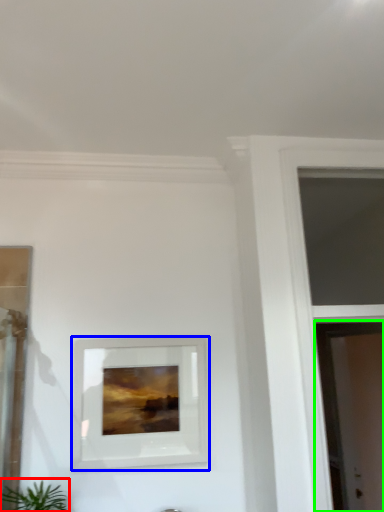
Question: Which object is positioned closest to houseplant (highlighted by a red box)? Select from picture frame (highlighted by a blue box) and screen door (highlighted by a green box).

Choices:
 (A) picture frame
 (B) screen door

Answer: (A)